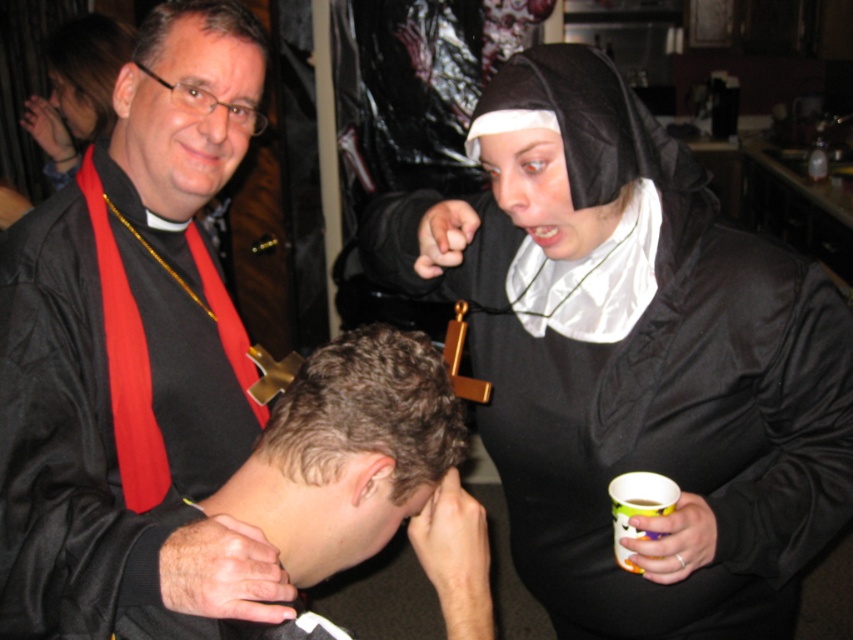
Consider the image. You are a photographer standing in the room. You want to take a photo of the black satin robe at left without moving any objects. Can you step forward 10 centimeters and still keep the robe in frame?

The black satin robe at left and viewer are 77.12 centimeters apart. If you step forward 10 centimeters, you will be 67.12 centimeters away. Since the robe is still within your camera frame at this distance, yes, you can step forward and keep the robe in frame.